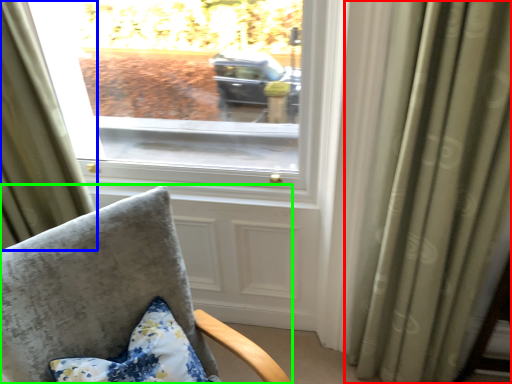
Question: Based on their relative distances, which object is farther from curtain (highlighted by a red box)? Choose from curtain (highlighted by a blue box) and chair (highlighted by a green box).

Choices:
 (A) curtain
 (B) chair

Answer: (A)